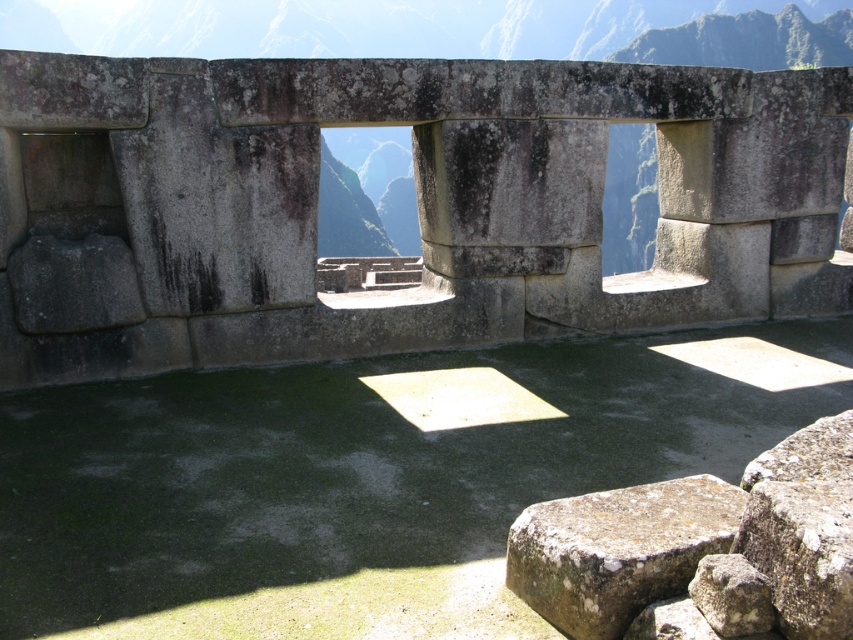
Can you confirm if gray stone wall at center is positioned to the right of rusty stone at lower right?

No, gray stone wall at center is not to the right of rusty stone at lower right.

Which of these two, gray stone wall at center or rusty stone at lower right, stands taller?

gray stone wall at center

Identify the location of gray stone wall at center. This screenshot has width=853, height=640. (366, 193).